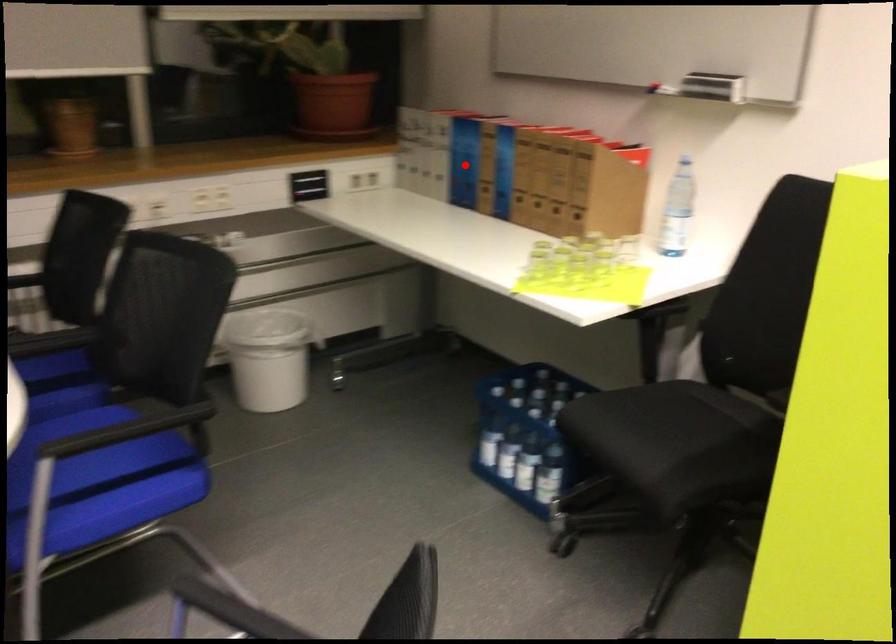
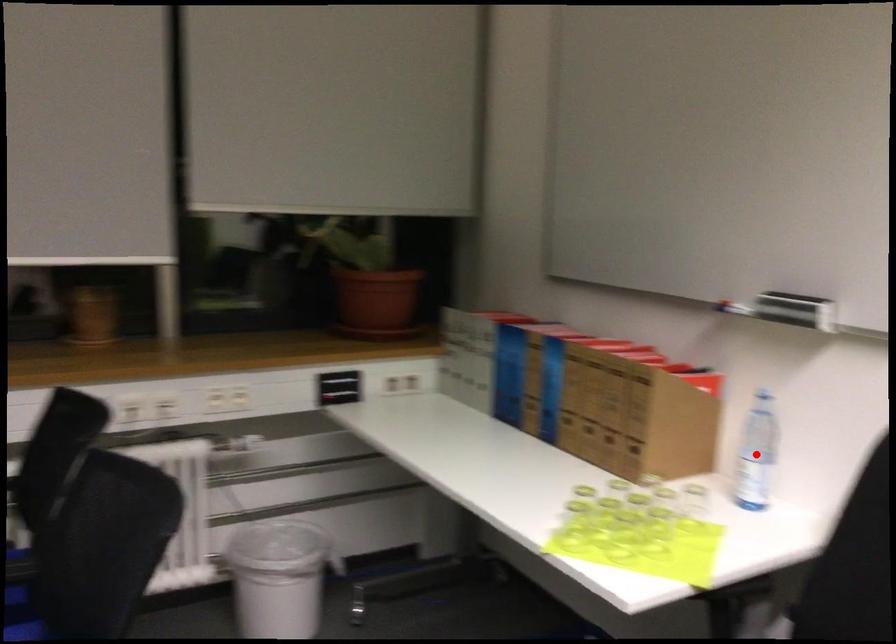
I am providing you with two images of the same scene from different viewpoints. A red point is marked on the first image and another point is marked on the second image. Do the highlighted points in image1 and image2 indicate the same real-world spot?

No